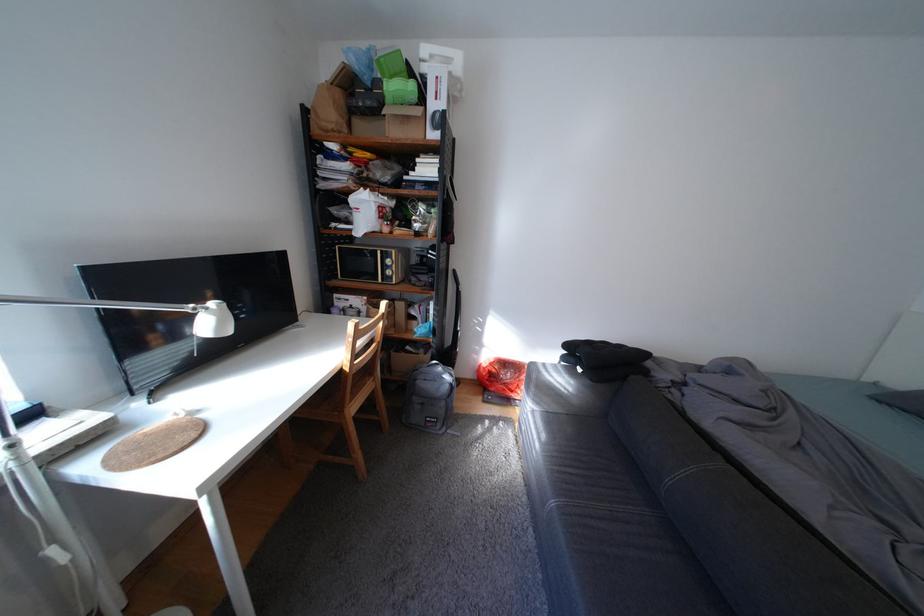
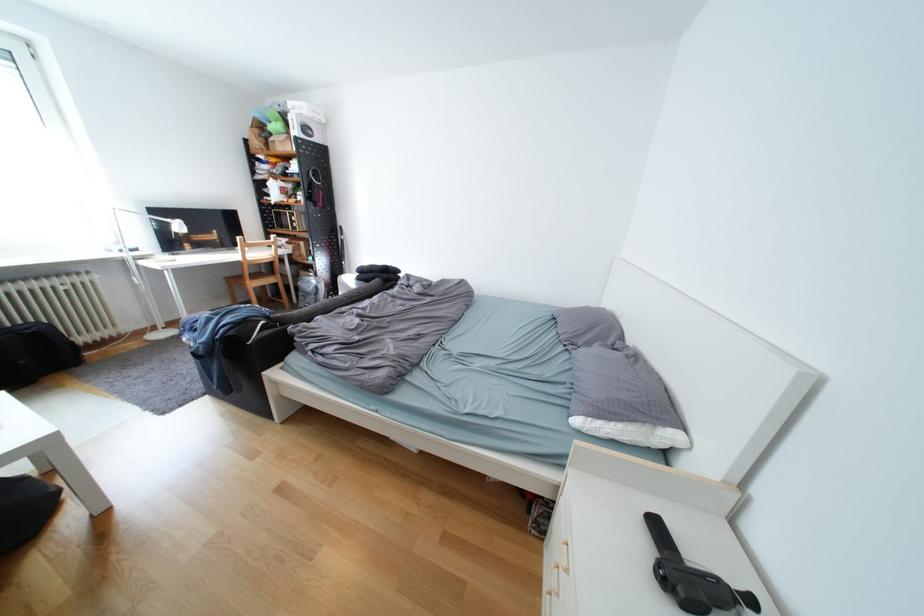
The point at [428,400] is marked in the first image. Where is the corresponding point in the second image?

(313, 294)